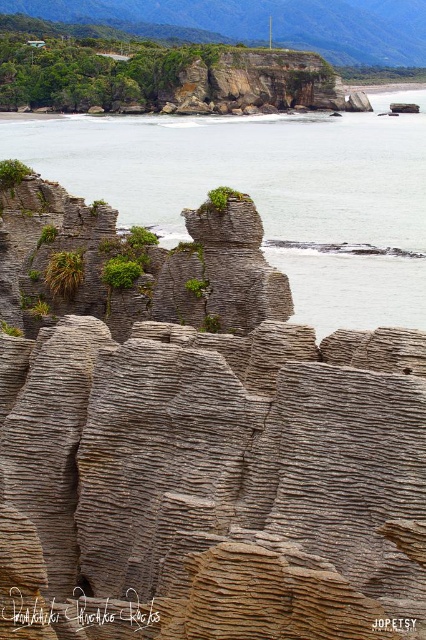
You are standing at the center of the image and want to find the brown textured rock formation at center. According to the coordinates provided, in which direction should you move to locate it?

The brown textured rock formation at center is located at coordinates point [198,442]. Since you are at the center, which is point [213,320], you should move northeast to reach it.

You are standing at the base of the Pancake Rocks and want to take a photo. There are two points of interest marked as point 1 at coordinates (94, 435) and point 2 at (23, 163). Which point is closer to your camera position?

Point 1 at coordinates (94, 435) is closer to the camera than point 2 at (23, 163).

You are standing at the point marked by the coordinates point (267, 193) in the coastal landscape. What type of terrain are you currently on?

The point (267, 193) corresponds to gray rocky water at center, so you are standing on gray rocky water.